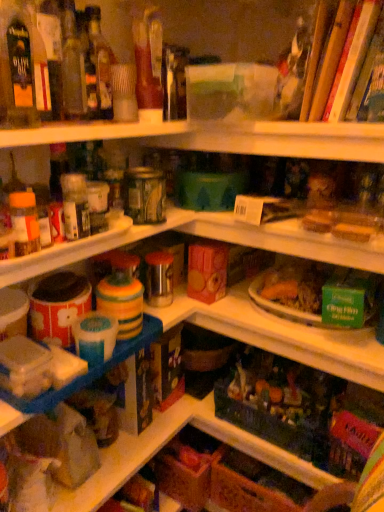
Question: From a real-world perspective, is translucent glass bottle at upper left, positioned as the first bottle in back-to-front order, positioned above or below wooden sticks at upper right?

Choices:
 (A) above
 (B) below

Answer: (B)

Question: From the image's perspective, relative to wooden sticks at upper right, is translucent glass bottle at upper left, placed as the 1th bottle when sorted from right to left, above or below?

Choices:
 (A) below
 (B) above

Answer: (A)

Question: Based on their relative distances, which object is nearer to the translucent glass bottle at upper left, placed as the 1th bottle when sorted from right to left?

Choices:
 (A) wooden sticks at upper right
 (B) matte glass bottle at upper left, marked as the second bottle in a back-to-front arrangement

Answer: (B)

Question: Estimate the real-world distances between objects in this image. Which object is farther from the wooden sticks at upper right?

Choices:
 (A) matte glass bottle at upper left, the second bottle from the right
 (B) translucent glass bottle at upper left, which ranks as the second bottle in front-to-back order

Answer: (A)